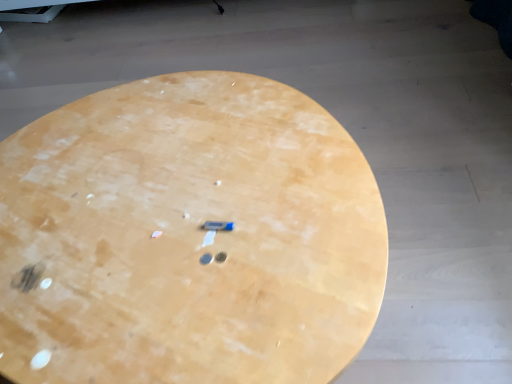
Where is `free space above wooden table at center (from a real-world perspective)`? This screenshot has height=384, width=512. free space above wooden table at center (from a real-world perspective) is located at coordinates (157, 183).